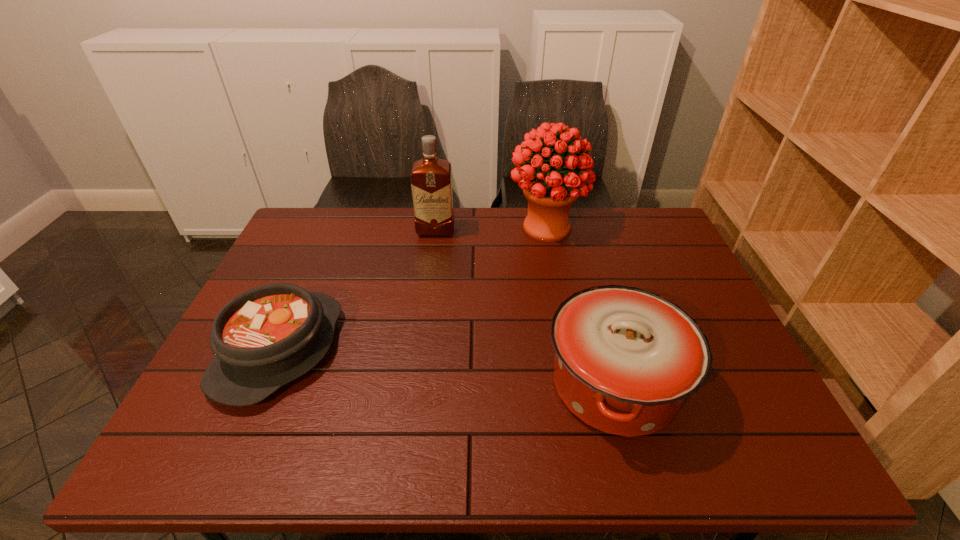
Image resolution: width=960 pixels, height=540 pixels. In order to click on free region that satisfies the following two spatial constraints: 1. on the front label of the taller casserole; 2. on the left side of the liquor in this screenshot , I will do `click(416, 384)`.

In order to click on vacant point that satisfies the following two spatial constraints: 1. on the front label of the right casserole; 2. on the left side of the liquor in this screenshot , I will do `click(416, 384)`.

Find the location of a particular element. This screenshot has width=960, height=540. free space that satisfies the following two spatial constraints: 1. on the front side of the third tallest object; 2. on the right side of the bouquet is located at coordinates (577, 384).

In order to click on vacant space that satisfies the following two spatial constraints: 1. on the front side of the bouquet; 2. on the left side of the second shortest object in this screenshot , I will do `click(577, 384)`.